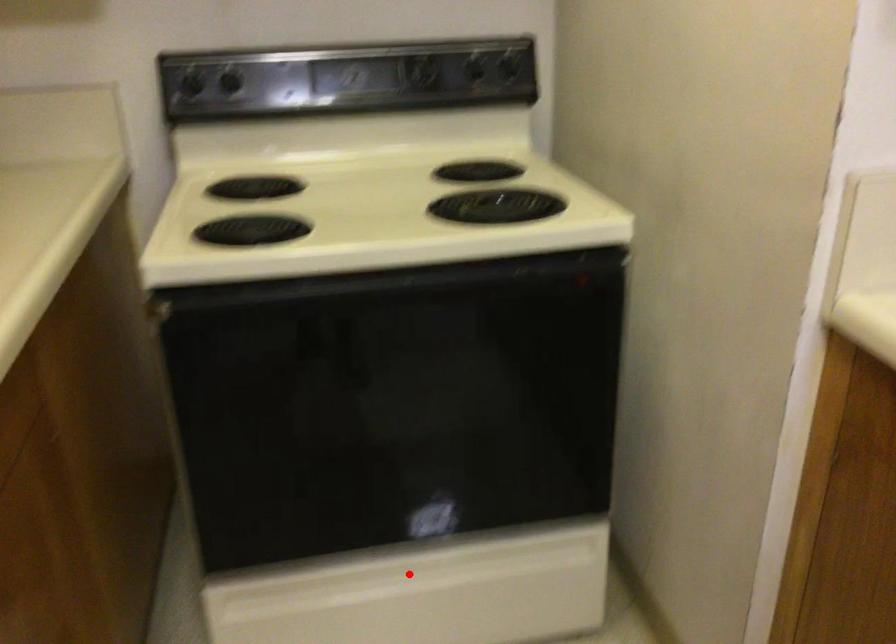
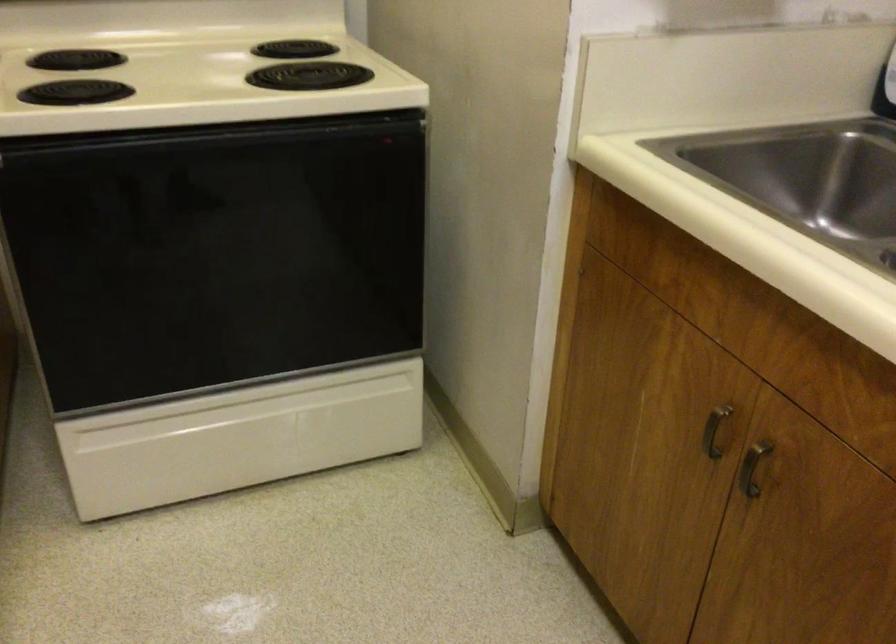
Question: I am providing you with two images of the same scene from different viewpoints. Image1 has a red point marked. In image2, the corresponding 3D location appears at what relative position? Reply with the corresponding letter.

Choices:
 (A) Closer
 (B) Farther

Answer: (B)